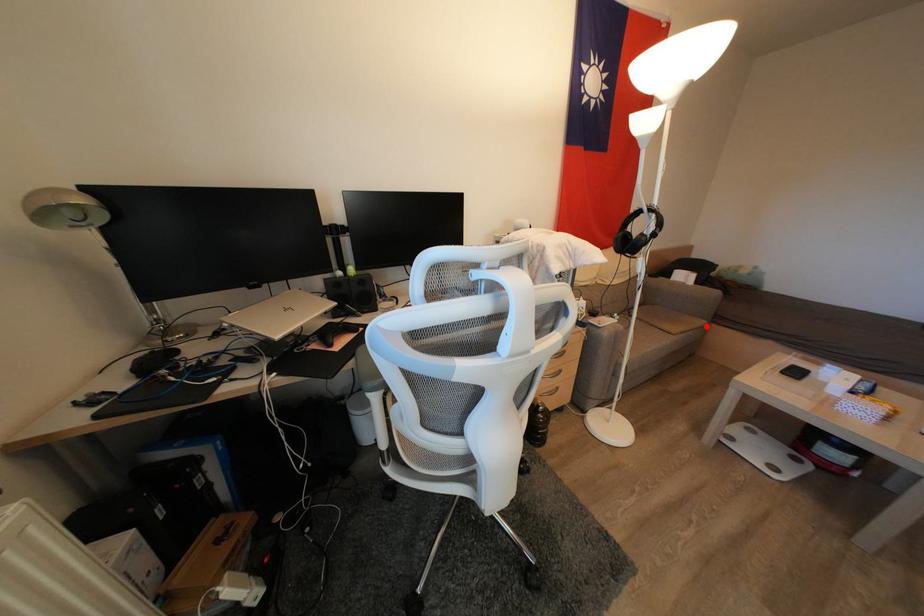
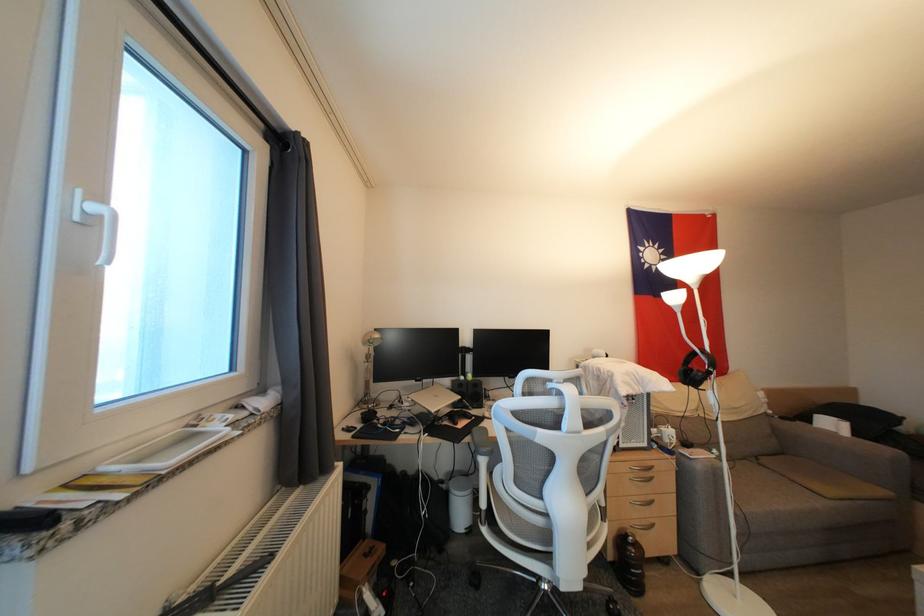
In the second image, find the point that corresponds to the highlighted location in the first image.

(889, 496)